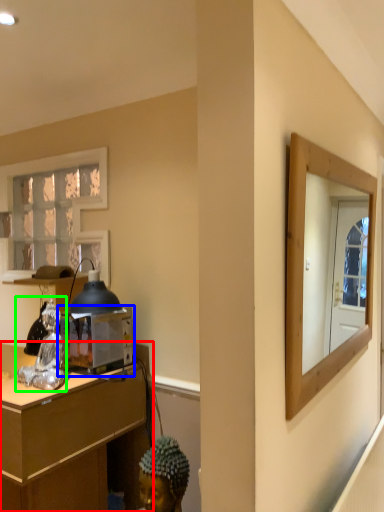
Question: Which is farther away from desk (highlighted by a red box)? appliance (highlighted by a blue box) or figurine (highlighted by a green box)?

Choices:
 (A) appliance
 (B) figurine

Answer: (B)